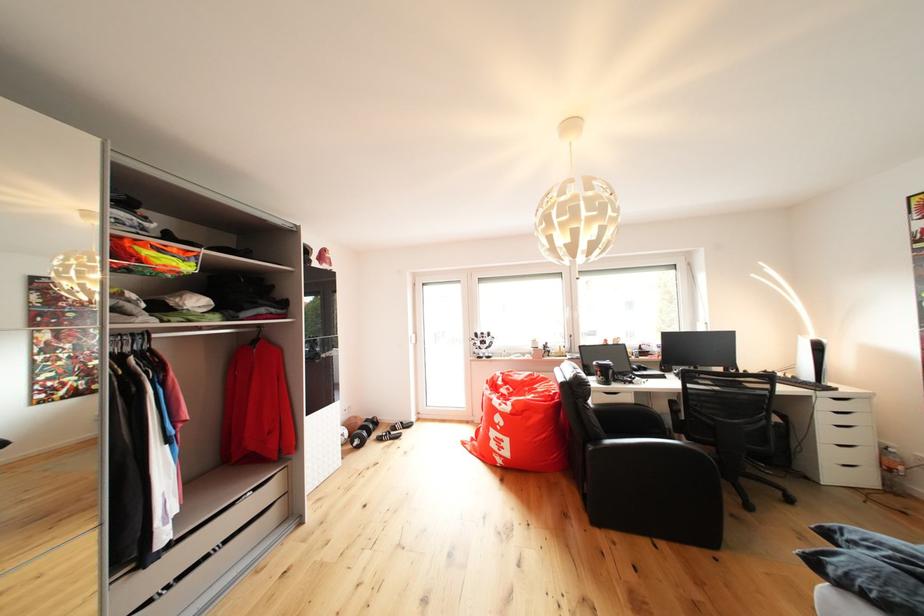
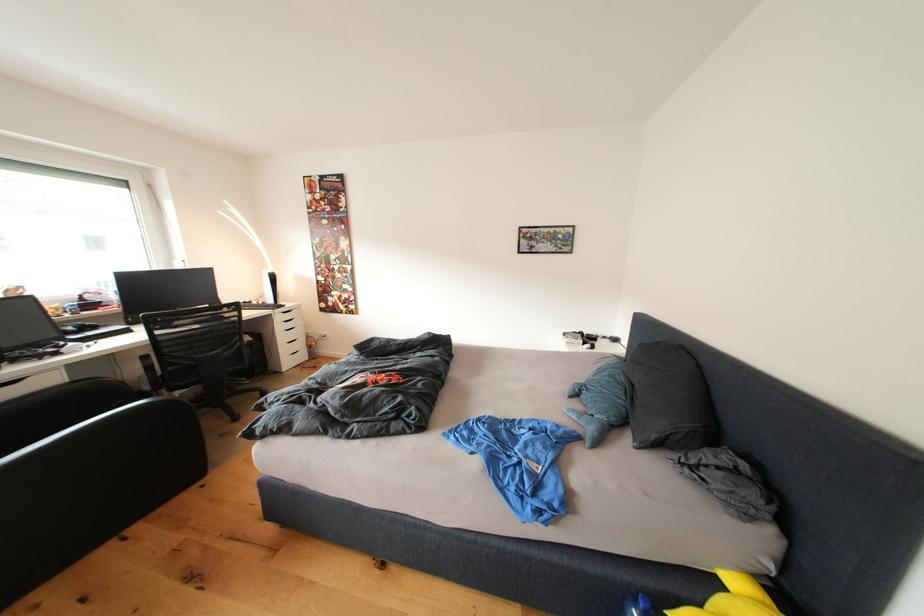
Question: How did the camera likely rotate?

Choices:
 (A) Left
 (B) Right
 (C) Up
 (D) Down

Answer: (B)